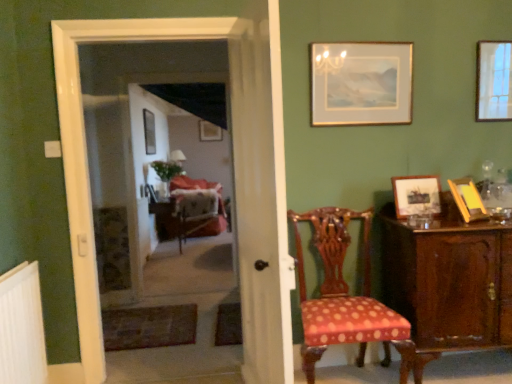
I want to click on mahogany cabinet at right, so click(448, 284).

Describe the element at coordinates (22, 326) in the screenshot. The width and height of the screenshot is (512, 384). I see `white plastic radiator at lower left` at that location.

What is the approximate height of matte black screen door at center?

matte black screen door at center is 2.08 meters in height.

Identify the location of wooden picture frame at upper right, the 4th picture frame when ordered from front to back. This screenshot has width=512, height=384. (494, 81).

Measure the distance between matte gold picture frame at center, placed as the second picture frame when sorted from left to right, and camera.

They are 6.69 meters apart.

This screenshot has height=384, width=512. I want to click on wooden picture frame at right, which is counted as the third picture frame, starting from the right, so 416,195.

Considering the relative positions of velvet upholstered armchair at center and white plastic radiator at lower left in the image provided, is velvet upholstered armchair at center to the left or to the right of white plastic radiator at lower left?

velvet upholstered armchair at center is to the right of white plastic radiator at lower left.

Is velvet upholstered armchair at center facing away from white plastic radiator at lower left?

No, velvet upholstered armchair at center is not facing away from white plastic radiator at lower left.

You are a GUI agent. You are given a task and a screenshot of the screen. Output one action in this format:
    pyautogui.click(x=<x>, y=<y>)
    Task: Click on the radiator that appears in front of the velvet upholstered armchair at center
    
    Given the screenshot: What is the action you would take?
    pyautogui.click(x=22, y=326)

Looking at this image, are velvet upholstered armchair at center and white plastic radiator at lower left beside each other?

No, velvet upholstered armchair at center is not in contact with white plastic radiator at lower left.

Between metallic silver picture frame at center, which appears as the second picture frame when viewed from the back, and velvet upholstered armchair at center, which one appears on the right side from the viewer's perspective?

velvet upholstered armchair at center.

Consider the image. Considering the sizes of metallic silver picture frame at center, which is counted as the first picture frame, starting from the left, and velvet upholstered armchair at center in the image, is metallic silver picture frame at center, which is counted as the first picture frame, starting from the left, wider or thinner than velvet upholstered armchair at center?

In the image, metallic silver picture frame at center, which is counted as the first picture frame, starting from the left, appears to be more narrow than velvet upholstered armchair at center.

Can you tell me how much metallic silver picture frame at center, which is counted as the first picture frame, starting from the left, and velvet upholstered armchair at center differ in facing direction?

The facing directions of metallic silver picture frame at center, which is counted as the first picture frame, starting from the left, and velvet upholstered armchair at center are 2.62 degrees apart.

Which point is more distant from viewer, (146, 109) or (196, 206)?

Point (196, 206)

Can you confirm if matte gold picture frame at center, the first picture frame viewed from the back, is wider than gold-framed picture at upper right, positioned as the third picture frame in left-to-right order?

Yes, matte gold picture frame at center, the first picture frame viewed from the back, is wider than gold-framed picture at upper right, positioned as the third picture frame in left-to-right order.

From a real-world perspective, does matte gold picture frame at center, positioned as the sixth picture frame in front-to-back order, stand above gold-framed picture at upper right, the 4th picture frame from the back?

Yes, from a real-world perspective, matte gold picture frame at center, positioned as the sixth picture frame in front-to-back order, is over gold-framed picture at upper right, the 4th picture frame from the back

Could gold-framed picture at upper right, the 4th picture frame positioned from the right, be considered to be inside matte gold picture frame at center, positioned as the sixth picture frame in front-to-back order?

No.

Based on the photo, considering the relative positions of wooden picture frame at right, which is counted as the third picture frame, starting from the right, and white sheer curtain at center in the image provided, is wooden picture frame at right, which is counted as the third picture frame, starting from the right, to the left or to the right of white sheer curtain at center?

wooden picture frame at right, which is counted as the third picture frame, starting from the right, is positioned on white sheer curtain at center's right side.

From the image's perspective, is wooden picture frame at right, which appears as the 5th picture frame when viewed from the back, positioned above or below white sheer curtain at center?

Based on their image positions, wooden picture frame at right, which appears as the 5th picture frame when viewed from the back, is located above white sheer curtain at center.

Is wooden picture frame at right, which appears as the 5th picture frame when viewed from the back, facing towards white sheer curtain at center?

No.

Which picture frame is the 2nd one when counting from the right side of the white sheer curtain at center? Please provide its 2D coordinates.

[(416, 195)]

Consider the image. Is white glossy door at center at the back of gold-framed picture at upper right, positioned as the third picture frame in left-to-right order?

No, white glossy door at center is not at the back of gold-framed picture at upper right, positioned as the third picture frame in left-to-right order.

You are a GUI agent. You are given a task and a screenshot of the screen. Output one action in this format:
    pyautogui.click(x=<x>, y=<y>)
    Task: Click on the door in front of the gold-framed picture at upper right, the 4th picture frame positioned from the right
    Image resolution: width=512 pixels, height=384 pixels.
    Given the screenshot: What is the action you would take?
    pyautogui.click(x=234, y=176)

Which is behind, gold-framed picture at upper right, positioned as the third picture frame in left-to-right order, or white glossy door at center?

gold-framed picture at upper right, positioned as the third picture frame in left-to-right order.

Considering the points (354, 53) and (281, 340), which point is behind, point (354, 53) or point (281, 340)?

Positioned behind is point (354, 53).

Is metallic silver picture frame at center, which is counted as the first picture frame, starting from the left, at the back of polka dot fabric chair at center?

polka dot fabric chair at center does not have its back to metallic silver picture frame at center, which is counted as the first picture frame, starting from the left.

Are polka dot fabric chair at center and metallic silver picture frame at center, which ranks as the 5th picture frame in front-to-back order, beside each other?

polka dot fabric chair at center and metallic silver picture frame at center, which ranks as the 5th picture frame in front-to-back order, are not in contact.

From a real-world perspective, is polka dot fabric chair at center above or below metallic silver picture frame at center, which ranks as the 5th picture frame in front-to-back order?

polka dot fabric chair at center is situated lower than metallic silver picture frame at center, which ranks as the 5th picture frame in front-to-back order, in the real world.

Between wooden picture frame at upper right, the 4th picture frame when ordered from front to back, and mahogany cabinet at right, which one appears on the left side from the viewer's perspective?

From the viewer's perspective, mahogany cabinet at right appears more on the left side.

Is wooden picture frame at upper right, marked as the 1th picture frame in a right-to-left arrangement, bigger than mahogany cabinet at right?

Actually, wooden picture frame at upper right, marked as the 1th picture frame in a right-to-left arrangement, might be smaller than mahogany cabinet at right.

Is point (506, 53) positioned before point (454, 244)?

No, (506, 53) is further to viewer.

From a real-world perspective, is wooden picture frame at upper right, marked as the 1th picture frame in a right-to-left arrangement, positioned over mahogany cabinet at right based on gravity?

Indeed, from a real-world perspective, wooden picture frame at upper right, marked as the 1th picture frame in a right-to-left arrangement, stands above mahogany cabinet at right.

You are a GUI agent. You are given a task and a screenshot of the screen. Output one action in this format:
    pyautogui.click(x=<x>, y=<y>)
    Task: Click on the armchair to the right of white plastic radiator at lower left
    
    Given the screenshot: What is the action you would take?
    pyautogui.click(x=194, y=210)

You are a GUI agent. You are given a task and a screenshot of the screen. Output one action in this format:
    pyautogui.click(x=<x>, y=<y>)
    Task: Click on the armchair behind the metallic silver picture frame at center, which ranks as the 5th picture frame in front-to-back order
    
    Given the screenshot: What is the action you would take?
    pyautogui.click(x=194, y=210)

Looking at the image, which one is located further to matte black screen door at center, white sheer curtain at center or wooden picture frame at right, which appears as the 5th picture frame when viewed from the back?

The object further to matte black screen door at center is wooden picture frame at right, which appears as the 5th picture frame when viewed from the back.

Which object lies nearer to the anchor point velvet upholstered armchair at center, wooden picture frame at right, which ranks as the second picture frame in front-to-back order, or gold-framed picture at upper right, positioned as the third picture frame in left-to-right order?

Based on the image, gold-framed picture at upper right, positioned as the third picture frame in left-to-right order, appears to be nearer to velvet upholstered armchair at center.

Based on their spatial positions, is polka dot fabric chair at center or wooden picture frame at right, the 2th picture frame from the right, closer to gold-framed picture at upper right, positioned as the third picture frame in left-to-right order?

Based on the image, wooden picture frame at right, the 2th picture frame from the right, appears to be nearer to gold-framed picture at upper right, positioned as the third picture frame in left-to-right order.

Looking at the image, which one is located closer to wooden picture frame at upper right, placed as the sixth picture frame when sorted from left to right, mahogany cabinet at right or gold-framed picture at upper right, which ranks as the third picture frame in front-to-back order?

Based on the image, gold-framed picture at upper right, which ranks as the third picture frame in front-to-back order, appears to be nearer to wooden picture frame at upper right, placed as the sixth picture frame when sorted from left to right.

Considering their positions, is gold-framed picture at upper right, the 4th picture frame positioned from the right, positioned closer to matte gold picture frame at center, the first picture frame viewed from the back, than polka dot fabric chair at center?

The object closer to matte gold picture frame at center, the first picture frame viewed from the back, is gold-framed picture at upper right, the 4th picture frame positioned from the right.

From the image, which object appears to be nearer to mahogany cabinet at right, velvet upholstered armchair at center or gold-framed picture at upper right, positioned as the third picture frame in left-to-right order?

The object closer to mahogany cabinet at right is gold-framed picture at upper right, positioned as the third picture frame in left-to-right order.

Consider the image. Based on their spatial positions, is polka dot fabric chair at center or mahogany cabinet at right further from velvet upholstered armchair at center?

mahogany cabinet at right is positioned further to the anchor velvet upholstered armchair at center.

Estimate the real-world distances between objects in this image. Which object is closer to metallic silver picture frame at center, which is counted as the first picture frame, starting from the left, white glossy door at center or wooden picture frame at right, which appears as the 5th picture frame when viewed from the back?

white glossy door at center is positioned closer to the anchor metallic silver picture frame at center, which is counted as the first picture frame, starting from the left.

This screenshot has width=512, height=384. Find the location of `screen door between polka dot fabric chair at center and velvet upholstered armchair at center in the front-back direction`. screen door between polka dot fabric chair at center and velvet upholstered armchair at center in the front-back direction is located at coordinates (177, 141).

Identify the location of curtain situated between white plastic radiator at lower left and wooden picture frame at right, the 2th picture frame from the right, from left to right. (260, 200).

Identify the location of chair between white sheer curtain at center and wooden picture frame at right, which appears as the 5th picture frame when viewed from the back, in the horizontal direction. (345, 296).

At what (x,y) coordinates should I click in order to perform the action: click on chair between white plastic radiator at lower left and gold-framed picture at upper right, positioned as the third picture frame in left-to-right order, from left to right. Please return your answer as a coordinate pair (x, y). The width and height of the screenshot is (512, 384). Looking at the image, I should click on (x=345, y=296).